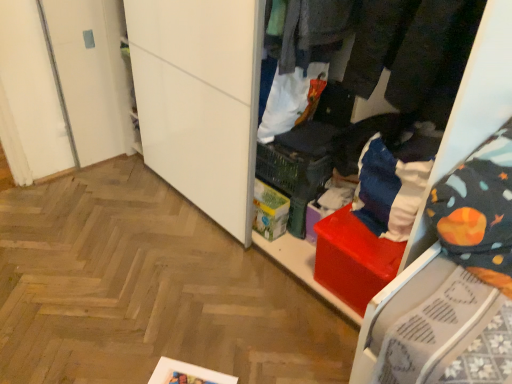
This screenshot has width=512, height=384. What do you see at coordinates (288, 100) in the screenshot? I see `white fabric bag at center, the 4th clothing positioned from the front` at bounding box center [288, 100].

Based on the photo, in order to face dark gray fabric pants at upper center, which appears as the 3th clothing when viewed from the front, should I rotate leftwards or rightwards?

Rotate your view right by about 9.822°.

How much space does black fabric pants at upper right, acting as the 4th clothing starting from the back, occupy vertically?

It is 16.06 inches.

Describe the element at coordinates (433, 58) in the screenshot. The height and width of the screenshot is (384, 512). I see `black fabric pants at upper right, acting as the 4th clothing starting from the back` at that location.

Identify the location of dark gray fabric pants at center, arranged as the third clothing when viewed from the back. (414, 52).

Identify the location of white fabric bag at center, positioned as the first clothing in back-to-front order. The width and height of the screenshot is (512, 384). (288, 100).

Considering the relative positions of black fabric pants at upper right, the 1th clothing positioned from the front, and dark gray fabric pants at upper center, which appears as the 3th clothing when viewed from the front, in the image provided, is black fabric pants at upper right, the 1th clothing positioned from the front, behind dark gray fabric pants at upper center, which appears as the 3th clothing when viewed from the front,?

No, black fabric pants at upper right, the 1th clothing positioned from the front, is closer to the viewer.

In the scene shown: Is black fabric pants at upper right, the 1th clothing positioned from the front, turned away from dark gray fabric pants at upper center, which appears as the 3th clothing when viewed from the front?

black fabric pants at upper right, the 1th clothing positioned from the front, does not have its back to dark gray fabric pants at upper center, which appears as the 3th clothing when viewed from the front.

Which object is wider, black fabric pants at upper right, acting as the 4th clothing starting from the back, or dark gray fabric pants at upper center, which appears as the 3th clothing when viewed from the front?

black fabric pants at upper right, acting as the 4th clothing starting from the back, is wider.

Which of these two, black fabric pants at upper right, acting as the 4th clothing starting from the back, or dark gray fabric pants at upper center, which appears as the 3th clothing when viewed from the front, stands shorter?

dark gray fabric pants at upper center, which appears as the 3th clothing when viewed from the front.

Between dark gray fabric pants at upper center, which appears as the 3th clothing when viewed from the front, and white fabric bag at center, positioned as the first clothing in back-to-front order, which one is positioned in front?

dark gray fabric pants at upper center, which appears as the 3th clothing when viewed from the front.

From the image's perspective, between dark gray fabric pants at upper center, marked as the 2th clothing in a back-to-front arrangement, and white fabric bag at center, the 4th clothing positioned from the front, who is located below?

white fabric bag at center, the 4th clothing positioned from the front.

At what (x,y) coordinates should I click in order to perform the action: click on the 1st clothing to the right of the white fabric bag at center, positioned as the first clothing in back-to-front order, starting your count from the anchor. Please return your answer as a coordinate pair (x, y). Looking at the image, I should click on (314, 31).

Is white cardboard box at center not near black fabric pants at upper right, acting as the 4th clothing starting from the back?

No, white cardboard box at center is not far from black fabric pants at upper right, acting as the 4th clothing starting from the back.

Does white cardboard box at center contain black fabric pants at upper right, the 1th clothing positioned from the front?

No, black fabric pants at upper right, the 1th clothing positioned from the front, is not inside white cardboard box at center.

Is the depth of white cardboard box at center greater than that of black fabric pants at upper right, the 1th clothing positioned from the front?

Yes, white cardboard box at center is behind black fabric pants at upper right, the 1th clothing positioned from the front.

Looking at this image, is dark gray fabric pants at center, acting as the second clothing starting from the front, not inside black fabric pants at upper right, acting as the 4th clothing starting from the back?

No, dark gray fabric pants at center, acting as the second clothing starting from the front, is inside or overlapping with black fabric pants at upper right, acting as the 4th clothing starting from the back.

Is dark gray fabric pants at center, arranged as the third clothing when viewed from the back, turned away from black fabric pants at upper right, the 1th clothing positioned from the front?

dark gray fabric pants at center, arranged as the third clothing when viewed from the back, does not have its back to black fabric pants at upper right, the 1th clothing positioned from the front.

From the image's perspective, is dark gray fabric pants at center, arranged as the third clothing when viewed from the back, under black fabric pants at upper right, acting as the 4th clothing starting from the back?

Actually, dark gray fabric pants at center, arranged as the third clothing when viewed from the back, appears above black fabric pants at upper right, acting as the 4th clothing starting from the back, in the image.

Considering the sizes of objects dark gray fabric pants at center, arranged as the third clothing when viewed from the back, and dark gray fabric pants at upper center, which appears as the 3th clothing when viewed from the front, in the image provided, who is thinner, dark gray fabric pants at center, arranged as the third clothing when viewed from the back, or dark gray fabric pants at upper center, which appears as the 3th clothing when viewed from the front,?

With smaller width is dark gray fabric pants at upper center, which appears as the 3th clothing when viewed from the front.

Is dark gray fabric pants at center, arranged as the third clothing when viewed from the back, outside of dark gray fabric pants at upper center, which appears as the 3th clothing when viewed from the front?

Yes, dark gray fabric pants at center, arranged as the third clothing when viewed from the back, is not within dark gray fabric pants at upper center, which appears as the 3th clothing when viewed from the front.

Is dark gray fabric pants at center, arranged as the third clothing when viewed from the back, turned away from dark gray fabric pants at upper center, marked as the 2th clothing in a back-to-front arrangement?

That's not correct — dark gray fabric pants at center, arranged as the third clothing when viewed from the back, is not looking away from dark gray fabric pants at upper center, marked as the 2th clothing in a back-to-front arrangement.

Is dark gray fabric pants at center, arranged as the third clothing when viewed from the back, to the left or to the right of dark gray fabric pants at upper center, which appears as the 3th clothing when viewed from the front, in the image?

Based on their positions, dark gray fabric pants at center, arranged as the third clothing when viewed from the back, is located to the right of dark gray fabric pants at upper center, which appears as the 3th clothing when viewed from the front.

From a real-world perspective, which clothing is the 2nd one above the white fabric bag at center, the 4th clothing positioned from the front? Please provide its 2D coordinates.

[(414, 52)]

From the image's perspective, between white fabric bag at center, the 4th clothing positioned from the front, and dark gray fabric pants at center, acting as the second clothing starting from the front, which one is located above?

From the image's view, dark gray fabric pants at center, acting as the second clothing starting from the front, is above.

From a real-world perspective, is white fabric bag at center, the 4th clothing positioned from the front, positioned above or below dark gray fabric pants at center, arranged as the third clothing when viewed from the back?

In terms of real-world spatial position, white fabric bag at center, the 4th clothing positioned from the front, is below dark gray fabric pants at center, arranged as the third clothing when viewed from the back.

Considering the sizes of objects dark gray fabric pants at upper center, which appears as the 3th clothing when viewed from the front, and white cardboard box at center in the image provided, who is wider, dark gray fabric pants at upper center, which appears as the 3th clothing when viewed from the front, or white cardboard box at center?

With larger width is dark gray fabric pants at upper center, which appears as the 3th clothing when viewed from the front.

Based on the photo, from a real-world perspective, is dark gray fabric pants at upper center, marked as the 2th clothing in a back-to-front arrangement, beneath white cardboard box at center?

No, from a real-world perspective, dark gray fabric pants at upper center, marked as the 2th clothing in a back-to-front arrangement, is not below white cardboard box at center.

At what (x,y) coordinates should I click in order to perform the action: click on storage box below the dark gray fabric pants at upper center, which appears as the 3th clothing when viewed from the front (from a real-world perspective). Please return your answer as a coordinate pair (x, y). The width and height of the screenshot is (512, 384). Looking at the image, I should click on (269, 211).

Considering the relative positions of dark gray fabric pants at upper center, marked as the 2th clothing in a back-to-front arrangement, and white cardboard box at center in the image provided, is dark gray fabric pants at upper center, marked as the 2th clothing in a back-to-front arrangement, to the left of white cardboard box at center from the viewer's perspective?

No.

There is a black fabric pants at upper right, acting as the 4th clothing starting from the back. At what (x,y) coordinates should I click in order to perform the action: click on the 2nd clothing above it (from the image's perspective). Please return your answer as a coordinate pair (x, y). Looking at the image, I should click on (314, 31).

Image resolution: width=512 pixels, height=384 pixels. Identify the location of clothing behind the dark gray fabric pants at upper center, marked as the 2th clothing in a back-to-front arrangement. (288, 100).

Estimate the real-world distances between objects in this image. Which object is further from white fabric bag at center, the 4th clothing positioned from the front, white cardboard box at center or black fabric pants at upper right, acting as the 4th clothing starting from the back?

The object further to white fabric bag at center, the 4th clothing positioned from the front, is black fabric pants at upper right, acting as the 4th clothing starting from the back.

Looking at the image, which one is located closer to dark gray fabric pants at upper center, marked as the 2th clothing in a back-to-front arrangement, black fabric pants at upper right, acting as the 4th clothing starting from the back, or white cardboard box at center?

black fabric pants at upper right, acting as the 4th clothing starting from the back, lies closer to dark gray fabric pants at upper center, marked as the 2th clothing in a back-to-front arrangement, than the other object.

Considering their positions, is white cardboard box at center positioned closer to white fabric bag at center, the 4th clothing positioned from the front, than dark gray fabric pants at upper center, marked as the 2th clothing in a back-to-front arrangement?

The object closer to white fabric bag at center, the 4th clothing positioned from the front, is dark gray fabric pants at upper center, marked as the 2th clothing in a back-to-front arrangement.

Looking at this image, considering their positions, is white fabric bag at center, the 4th clothing positioned from the front, positioned further to black fabric pants at upper right, acting as the 4th clothing starting from the back, than white cardboard box at center?

Among the two, white cardboard box at center is located further to black fabric pants at upper right, acting as the 4th clothing starting from the back.

In the scene shown: From the image, which object appears to be farther from dark gray fabric pants at center, arranged as the third clothing when viewed from the back, black fabric pants at upper right, acting as the 4th clothing starting from the back, or white fabric bag at center, the 4th clothing positioned from the front?

white fabric bag at center, the 4th clothing positioned from the front, lies further to dark gray fabric pants at center, arranged as the third clothing when viewed from the back, than the other object.

Considering their positions, is white cardboard box at center positioned further to white fabric bag at center, positioned as the first clothing in back-to-front order, than dark gray fabric pants at center, arranged as the third clothing when viewed from the back?

Based on the image, dark gray fabric pants at center, arranged as the third clothing when viewed from the back, appears to be further to white fabric bag at center, positioned as the first clothing in back-to-front order.

Which object lies further to the anchor point dark gray fabric pants at center, acting as the second clothing starting from the front, dark gray fabric pants at upper center, which appears as the 3th clothing when viewed from the front, or white fabric bag at center, the 4th clothing positioned from the front?

white fabric bag at center, the 4th clothing positioned from the front, is positioned further to the anchor dark gray fabric pants at center, acting as the second clothing starting from the front.

Looking at the image, which one is located closer to white cardboard box at center, black fabric pants at upper right, the 1th clothing positioned from the front, or dark gray fabric pants at upper center, marked as the 2th clothing in a back-to-front arrangement?

dark gray fabric pants at upper center, marked as the 2th clothing in a back-to-front arrangement.

The image size is (512, 384). Identify the location of clothing positioned between dark gray fabric pants at center, acting as the second clothing starting from the front, and white fabric bag at center, positioned as the first clothing in back-to-front order, from near to far. (314, 31).

You are a GUI agent. You are given a task and a screenshot of the screen. Output one action in this format:
    pyautogui.click(x=<x>, y=<y>)
    Task: Click on the clothing between black fabric pants at upper right, the 1th clothing positioned from the front, and dark gray fabric pants at upper center, marked as the 2th clothing in a back-to-front arrangement, from front to back
    
    Given the screenshot: What is the action you would take?
    pyautogui.click(x=414, y=52)